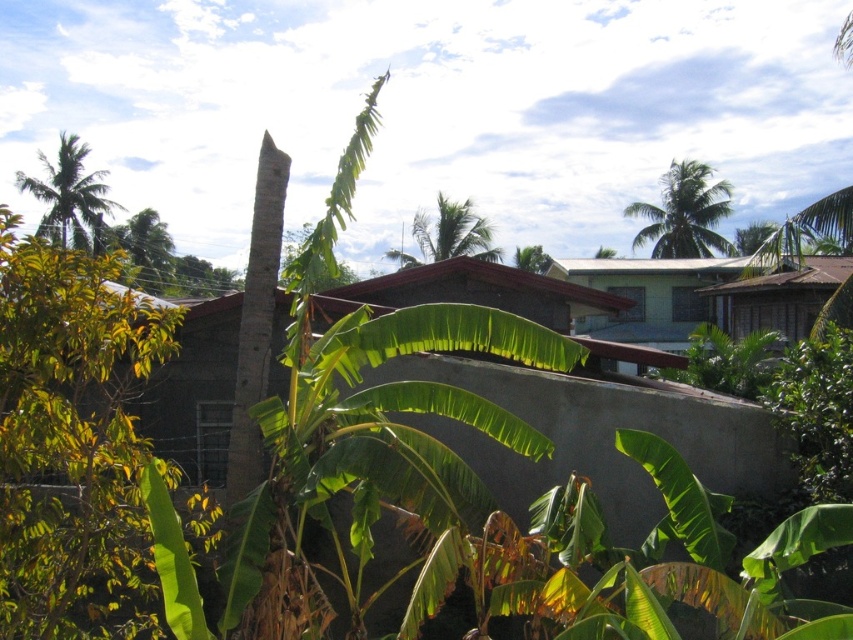
Question: Considering the relative positions of green leafy palm tree at upper right and green leafy palm tree at upper left in the image provided, where is green leafy palm tree at upper right located with respect to green leafy palm tree at upper left?

Choices:
 (A) above
 (B) below

Answer: (B)

Question: Among these objects, which one is farthest from the camera?

Choices:
 (A) green leafy palm tree at upper center
 (B) brown wooden hut at upper right
 (C) green leafy palm tree at upper left

Answer: (A)

Question: Which point appears farthest from the camera in this image?

Choices:
 (A) (705, 218)
 (B) (424, 253)
 (C) (787, 320)
 (D) (84, 214)

Answer: (B)

Question: Does green leafy palm tree at upper right appear over green leafy palm tree at upper left?

Choices:
 (A) yes
 (B) no

Answer: (B)

Question: Which of the following is the closest to the observer?

Choices:
 (A) (647, 204)
 (B) (801, 330)
 (C) (415, 230)

Answer: (B)

Question: Can you confirm if green leafy palm tree at upper left is positioned above green leafy palm tree at upper center?

Choices:
 (A) yes
 (B) no

Answer: (A)